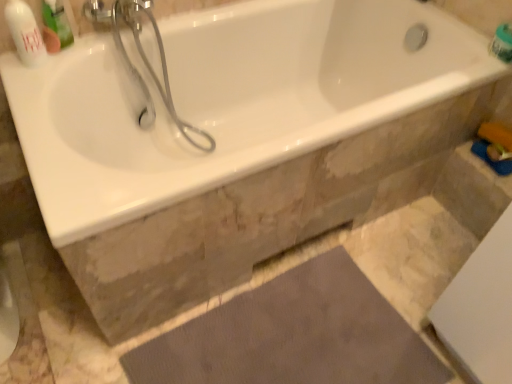
At what (x,y) coordinates should I click in order to perform the action: click on free space above brown textured mat at lower center (from a real-world perspective). Please return your answer as a coordinate pair (x, y). Looking at the image, I should click on (293, 339).